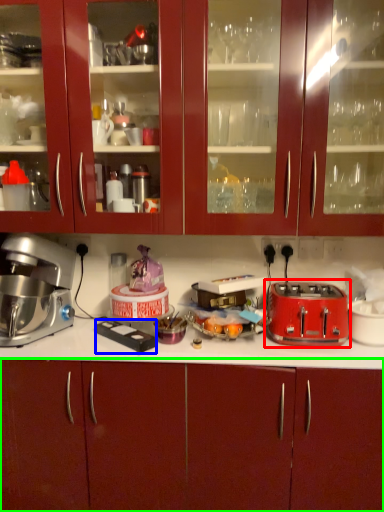
Question: Which is farther away from toaster (highlighted by a red box)? appliance (highlighted by a blue box) or cabinetry (highlighted by a green box)?

Choices:
 (A) appliance
 (B) cabinetry

Answer: (A)